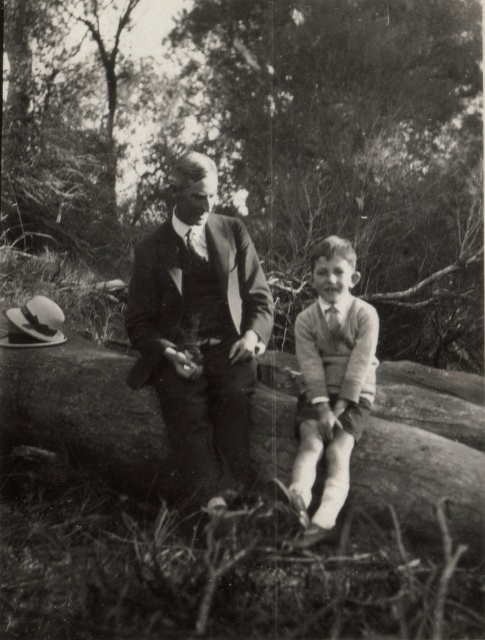
Question: Is smooth bark tree trunk at center positioned in front of knitted sweater at center?

Choices:
 (A) no
 (B) yes

Answer: (A)

Question: Can you confirm if smooth suit at center is positioned below knitted sweater at center?

Choices:
 (A) no
 (B) yes

Answer: (A)

Question: Does smooth bark tree trunk at center have a lesser width compared to smooth suit at center?

Choices:
 (A) no
 (B) yes

Answer: (A)

Question: Which point is farther from the camera taking this photo?

Choices:
 (A) (6, 157)
 (B) (313, 531)

Answer: (A)

Question: Which object appears farthest from the camera in this image?

Choices:
 (A) smooth suit at center
 (B) smooth bark tree trunk at center

Answer: (B)

Question: Which object is the closest to the knitted sweater at center?

Choices:
 (A) smooth bark tree trunk at center
 (B) smooth suit at center

Answer: (B)